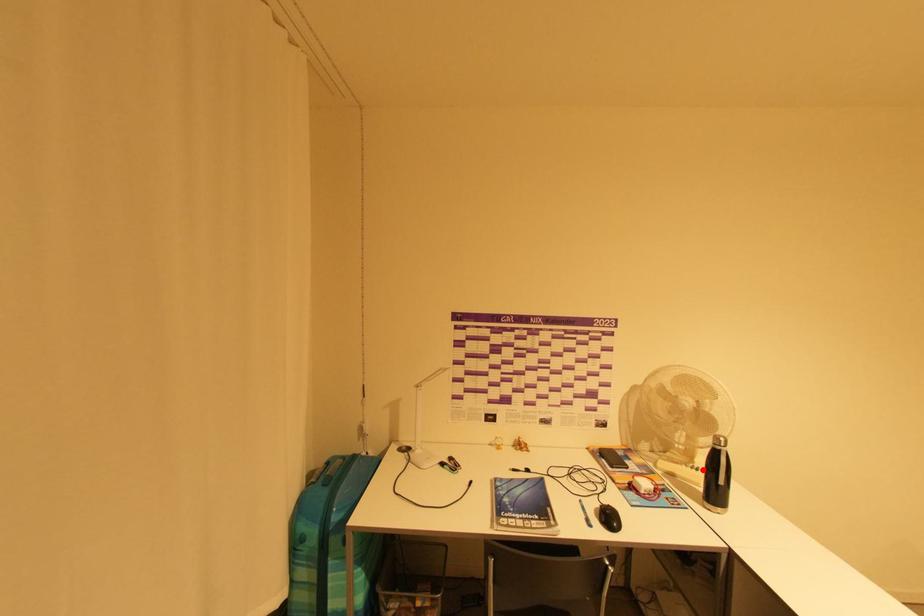
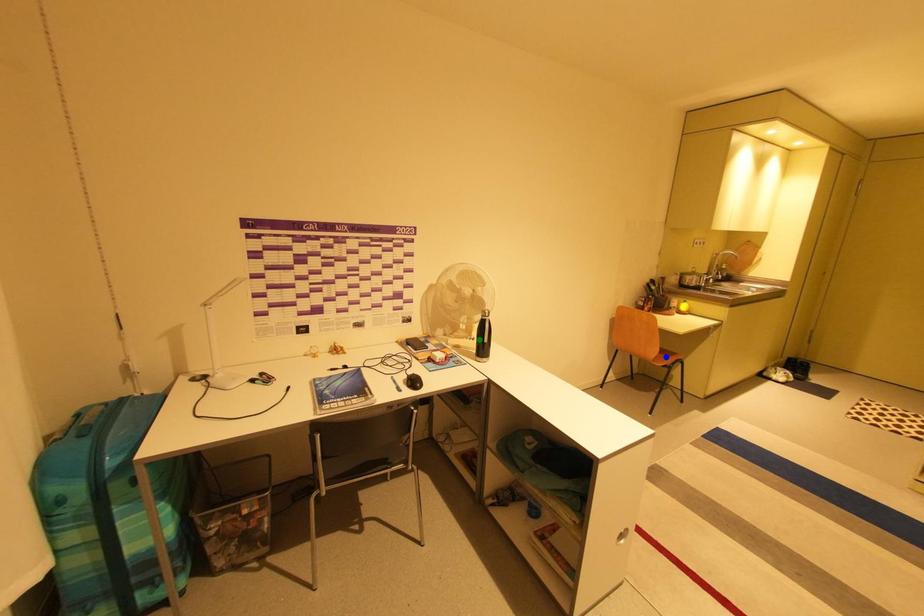
Question: I am providing you with two images of the same scene from different viewpoints. A red point is marked on the first image. You are given multiple points on the second image. Which point in image 2 is actually the same real-world point as the red point in image 1?

Choices:
 (A) blue point
 (B) green point
 (C) yellow point

Answer: (B)